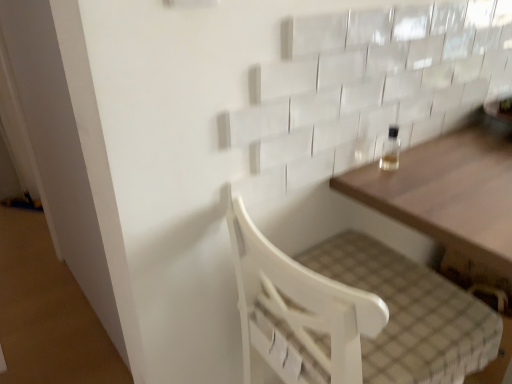
Question: From a real-world perspective, does clear glass bottle at upper right stand above wooden table at upper right?

Choices:
 (A) yes
 (B) no

Answer: (A)

Question: Is clear glass bottle at upper right thinner than wooden table at upper right?

Choices:
 (A) yes
 (B) no

Answer: (A)

Question: Is clear glass bottle at upper right at the right side of wooden table at upper right?

Choices:
 (A) yes
 (B) no

Answer: (B)

Question: From the image's perspective, is clear glass bottle at upper right on wooden table at upper right?

Choices:
 (A) no
 (B) yes

Answer: (B)

Question: Is clear glass bottle at upper right not inside wooden table at upper right?

Choices:
 (A) yes
 (B) no

Answer: (A)

Question: Is wooden table at upper right inside or outside of clear glass bottle at upper right?

Choices:
 (A) outside
 (B) inside

Answer: (A)

Question: Is wooden table at upper right wider or thinner than clear glass bottle at upper right?

Choices:
 (A) thin
 (B) wide

Answer: (B)

Question: From a real-world perspective, is wooden table at upper right positioned above or below clear glass bottle at upper right?

Choices:
 (A) below
 (B) above

Answer: (A)

Question: Would you say wooden table at upper right is to the left or to the right of clear glass bottle at upper right in the picture?

Choices:
 (A) right
 (B) left

Answer: (A)

Question: Considering the positions of clear glass bottle at upper right and white wood chair at lower center in the image, is clear glass bottle at upper right bigger or smaller than white wood chair at lower center?

Choices:
 (A) big
 (B) small

Answer: (B)

Question: From their relative heights in the image, would you say clear glass bottle at upper right is taller or shorter than white wood chair at lower center?

Choices:
 (A) tall
 (B) short

Answer: (B)

Question: Visually, is clear glass bottle at upper right positioned to the left or to the right of white wood chair at lower center?

Choices:
 (A) left
 (B) right

Answer: (B)

Question: From the image's perspective, is clear glass bottle at upper right above or below white wood chair at lower center?

Choices:
 (A) above
 (B) below

Answer: (A)

Question: From the image's perspective, is wooden table at upper right positioned above or below white wood chair at lower center?

Choices:
 (A) above
 (B) below

Answer: (A)

Question: In terms of width, does wooden table at upper right look wider or thinner when compared to white wood chair at lower center?

Choices:
 (A) thin
 (B) wide

Answer: (A)